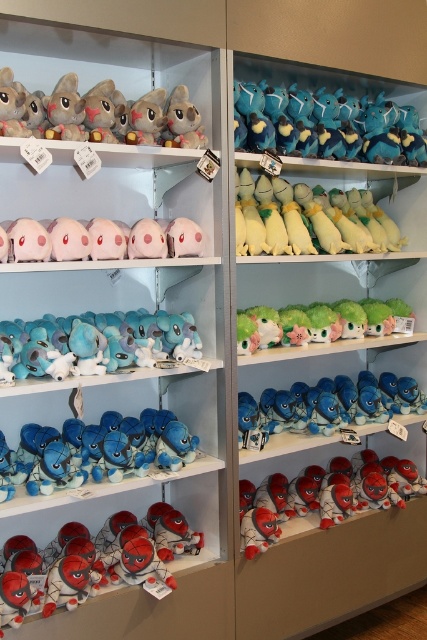
Between point (88, 454) and point (304, 326), which one is positioned behind?

Positioned behind is point (304, 326).

Looking at this image, can you confirm if matte blue plush at center is wider than green plush toy at center?

In fact, matte blue plush at center might be narrower than green plush toy at center.

The width and height of the screenshot is (427, 640). I want to click on matte blue plush at center, so click(x=101, y=451).

Can you confirm if matte blue plush at center is positioned above red plush spiderman at lower right?

Yes, matte blue plush at center is above red plush spiderman at lower right.

Is matte blue plush at center below red plush spiderman at lower right?

No, matte blue plush at center is not below red plush spiderman at lower right.

The image size is (427, 640). Identify the location of matte blue plush at center. (101, 451).

Identify the location of matte blue plush at center. The image size is (427, 640). point(101,451).

Can you confirm if blue plush toy at center is positioned to the left of pink plush toy at center?

In fact, blue plush toy at center is to the right of pink plush toy at center.

Who is more forward, (307, 419) or (170, 236)?

Positioned in front is point (170, 236).

Which is in front, point (394, 410) or point (189, 230)?

Point (189, 230) is in front.

Find the location of a particular element. The width and height of the screenshot is (427, 640). blue plush toy at center is located at coordinates (315, 416).